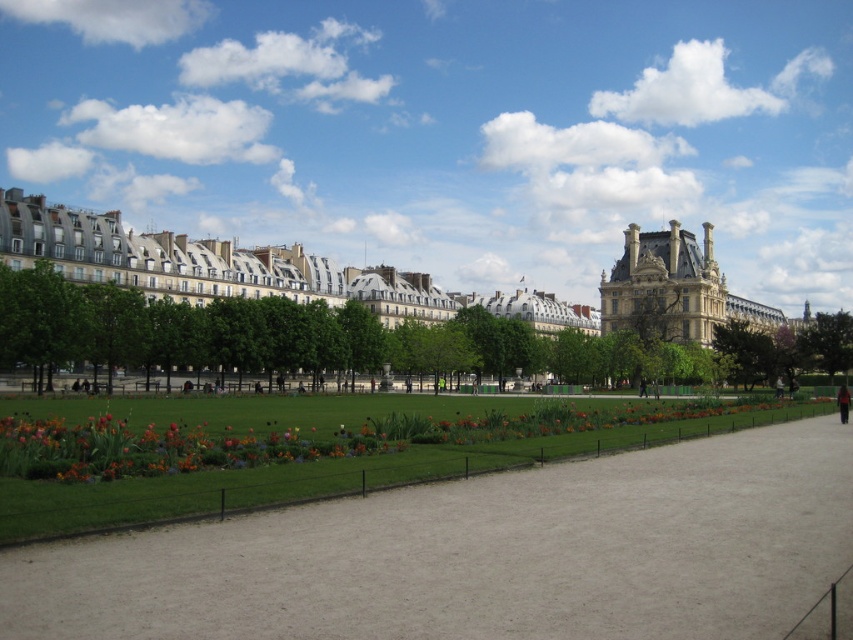
Question: Which point is farther from the camera taking this photo?

Choices:
 (A) (494, 305)
 (B) (403, 534)
 (C) (738, 355)

Answer: (A)

Question: Can you confirm if stone/brick palace at upper right is wider than black fabric person at center?

Choices:
 (A) yes
 (B) no

Answer: (A)

Question: Which point is farther to the camera?

Choices:
 (A) (666, 273)
 (B) (496, 372)
 (C) (656, 300)
 (D) (62, 344)

Answer: (C)

Question: Which object appears farthest from the camera in this image?

Choices:
 (A) green leafy tree at center
 (B) stone/brick palace at upper center
 (C) green grass at center
 (D) green leafy tree at left

Answer: (B)

Question: Is stone/brick palace at upper right positioned before black fabric person at center?

Choices:
 (A) yes
 (B) no

Answer: (B)

Question: Is green leafy tree at right smaller than black fabric person at center?

Choices:
 (A) yes
 (B) no

Answer: (B)